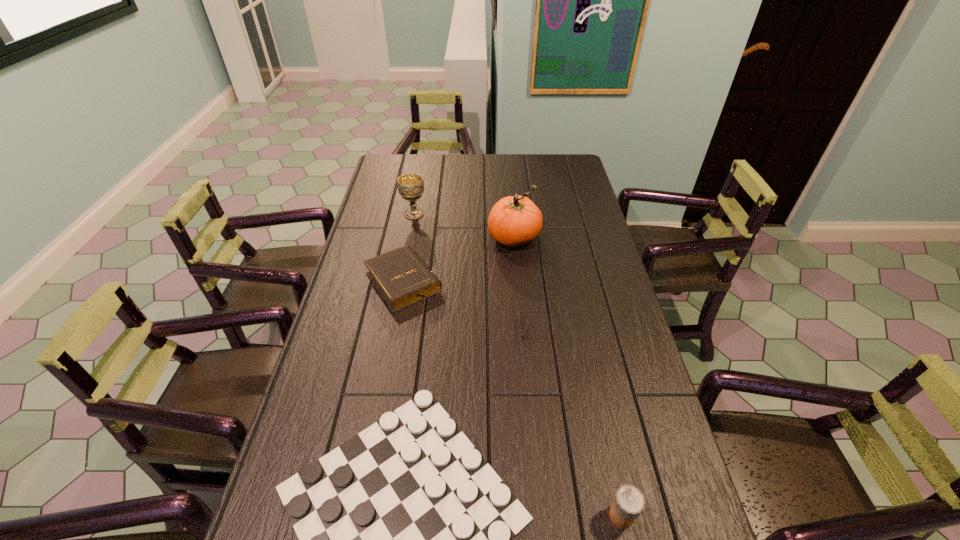
You are a GUI agent. You are given a task and a screenshot of the screen. Output one action in this format:
    pyautogui.click(x=<x>, y=<y>)
    Task: Click on the tallest object
    Image resolution: width=960 pixels, height=540 pixels.
    Given the screenshot: What is the action you would take?
    pyautogui.click(x=514, y=220)

Where is `chalice`? The width and height of the screenshot is (960, 540). chalice is located at coordinates (410, 186).

Identify the location of the farthest object. This screenshot has width=960, height=540. (410, 186).

The height and width of the screenshot is (540, 960). I want to click on the rightmost object, so click(x=629, y=502).

Identify the location of medicine. The height and width of the screenshot is (540, 960). (629, 502).

Locate an element on the screen. The image size is (960, 540). Bible is located at coordinates (401, 277).

The width and height of the screenshot is (960, 540). Identify the location of the fifth tallest object. (521, 312).

At what (x,y) coordinates should I click in order to perform the action: click on the fourth farthest object. Please return your answer as a coordinate pair (x, y). Looking at the image, I should click on point(521,312).

Where is `vacant space located 0.050m on the front of the tallest object`? Image resolution: width=960 pixels, height=540 pixels. vacant space located 0.050m on the front of the tallest object is located at coordinates (516, 265).

This screenshot has height=540, width=960. Identify the location of free spot located 0.290m on the back of the chalice. (422, 171).